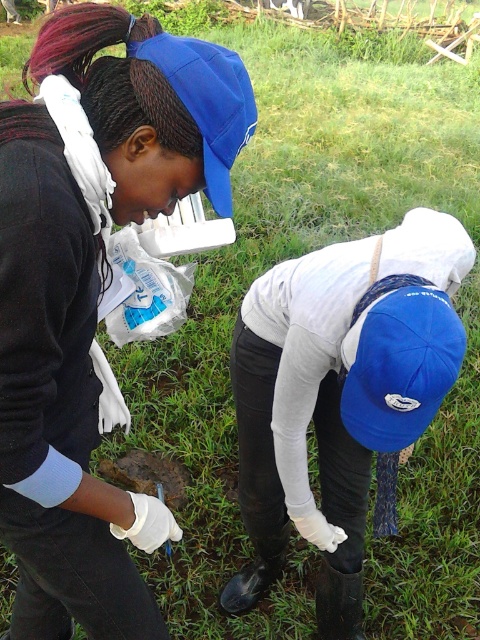
You are a researcher in the field and need to locate your white matte gloves at lower center. According to the coordinates given, where would you find them?

The white matte gloves at lower center are located at point [338,394].

From the picture: You are a photographer taking a picture of the scene. You notice the white matte gloves at lower center and the blue fabric baseball cap at lower center. Which object is closer to the camera?

The white matte gloves at lower center are positioned under the blue fabric baseball cap at lower center, so the blue fabric baseball cap at lower center is closer to the camera.

You are standing in the grassy field and see two points marked in the scene. Which point, point (x=250, y=483) or point (x=403, y=420), is closer to you?

Point (x=250, y=483) is closer to you because it is further to the viewer than point (x=403, y=420).